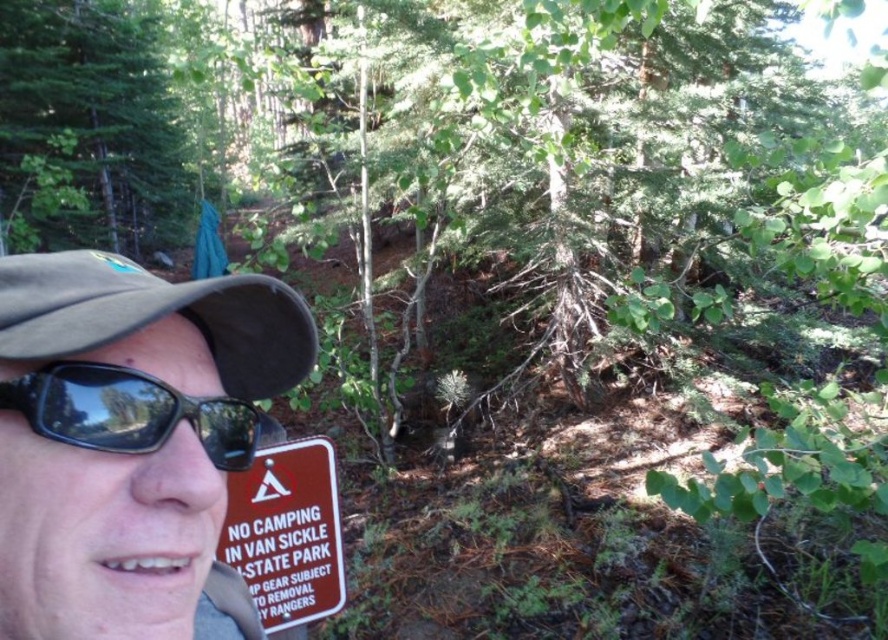
Question: Which is nearer to the red plastic sign at lower left?

Choices:
 (A) matte brown cap at upper left
 (B) black rubber sunglasses at left

Answer: (A)

Question: Is red plastic sign at lower left thinner than black rubber sunglasses at left?

Choices:
 (A) no
 (B) yes

Answer: (A)

Question: Is brown fabric cap at left to the right of red plastic sign at lower left from the viewer's perspective?

Choices:
 (A) no
 (B) yes

Answer: (B)

Question: Which object appears farthest from the camera in this image?

Choices:
 (A) red plastic sign at lower left
 (B) brown fabric cap at left
 (C) black rubber sunglasses at left

Answer: (A)

Question: Does matte brown cap at upper left lie in front of brown fabric cap at left?

Choices:
 (A) yes
 (B) no

Answer: (A)

Question: Which point appears closest to the camera in this image?

Choices:
 (A) (96, 321)
 (B) (70, 260)
 (C) (164, 412)

Answer: (A)